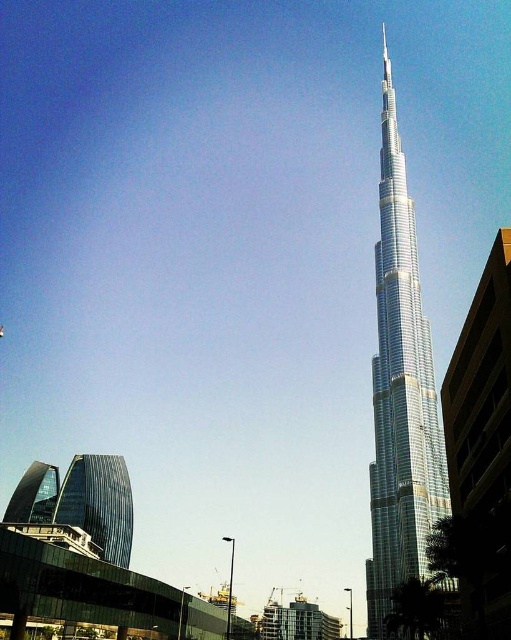
You are a drone operator tasked with flying a drone between the shiny glass skyscraper at right and the glassy reflective skyscraper at lower left. The drone has a maximum flight distance of 80 meters. Can the drone safely fly between these two skyscrapers without exceeding its range?

The distance between the shiny glass skyscraper at right and the glassy reflective skyscraper at lower left is 78.88 meters, which is within the drone operator maximum flight distance of 80 meters. Therefore, the drone can safely fly between them without exceeding its range.

You are standing at a viewpoint where you can see both the shiny glass skyscraper at right and the glassy reflective skyscraper at lower left. Which of these two skyscrapers is positioned higher in the image?

The shiny glass skyscraper at right is positioned higher in the image than the glassy reflective skyscraper at lower left.

You are standing at the center of the image and want to take a photo of the shiny glass skyscraper at right. In which direction should you move to get it centered in your camera view?

The shiny glass skyscraper at right is located at point [401,392], so you should move to the right and slightly upwards to center it in your camera view.